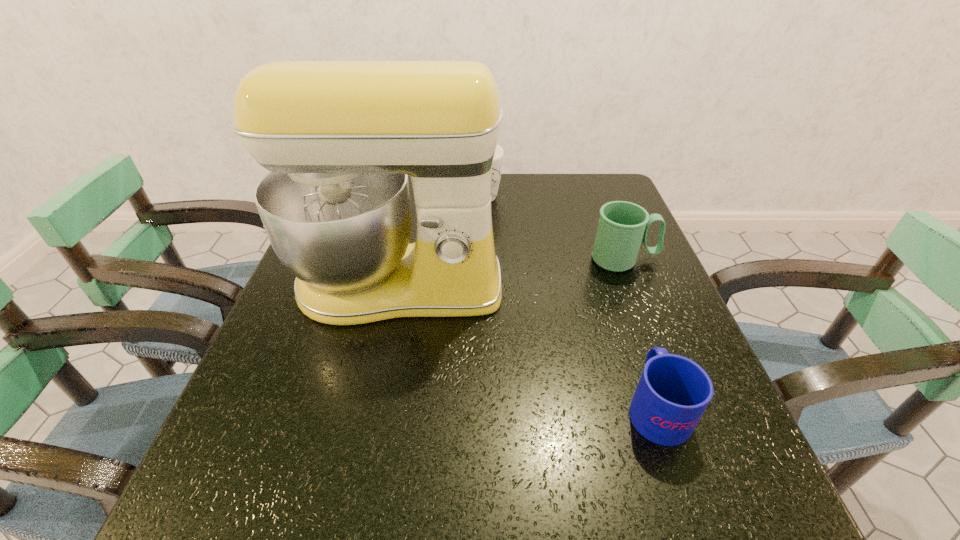
Where is `free location located 0.290m on the side with the handle of the nearest mug`? This screenshot has height=540, width=960. free location located 0.290m on the side with the handle of the nearest mug is located at coordinates (610, 271).

You are a GUI agent. You are given a task and a screenshot of the screen. Output one action in this format:
    pyautogui.click(x=<x>, y=<y>)
    Task: Click on the object situated at the far edge
    
    Given the screenshot: What is the action you would take?
    pyautogui.click(x=498, y=156)

Where is `object that is at the left edge`? The width and height of the screenshot is (960, 540). object that is at the left edge is located at coordinates (340, 138).

Where is `vacant space at the near edge of the desktop`? vacant space at the near edge of the desktop is located at coordinates [x=402, y=519].

At what (x,y) coordinates should I click in order to perform the action: click on vacant area at the left edge of the desktop. Please return your answer as a coordinate pair (x, y). The height and width of the screenshot is (540, 960). Looking at the image, I should click on (344, 331).

This screenshot has height=540, width=960. In the image, there is a desktop. Find the location of `free space at the right edge`. free space at the right edge is located at coordinates (580, 238).

Where is `vacant position at the far right corner of the desktop`? The image size is (960, 540). vacant position at the far right corner of the desktop is located at coordinates (611, 177).

This screenshot has height=540, width=960. What are the coordinates of `vacant space in between the shortest object and the mixer` in the screenshot? It's located at [x=527, y=347].

You are a GUI agent. You are given a task and a screenshot of the screen. Output one action in this format:
    pyautogui.click(x=<x>, y=<y>)
    Task: Click on the empty space that is in between the mixer and the second nearest mug
    
    Given the screenshot: What is the action you would take?
    click(x=512, y=273)

What are the coordinates of `vacant area that lies between the farthest mug and the second nearest mug` in the screenshot? It's located at (549, 228).